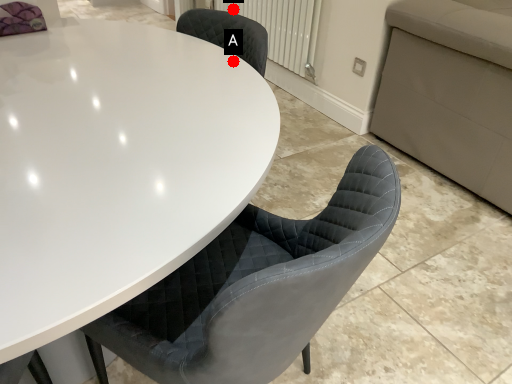
Question: Two points are circled on the image, labeled by A and B beside each circle. Which point appears farthest from the camera in this image?

Choices:
 (A) A is further
 (B) B is further

Answer: (B)